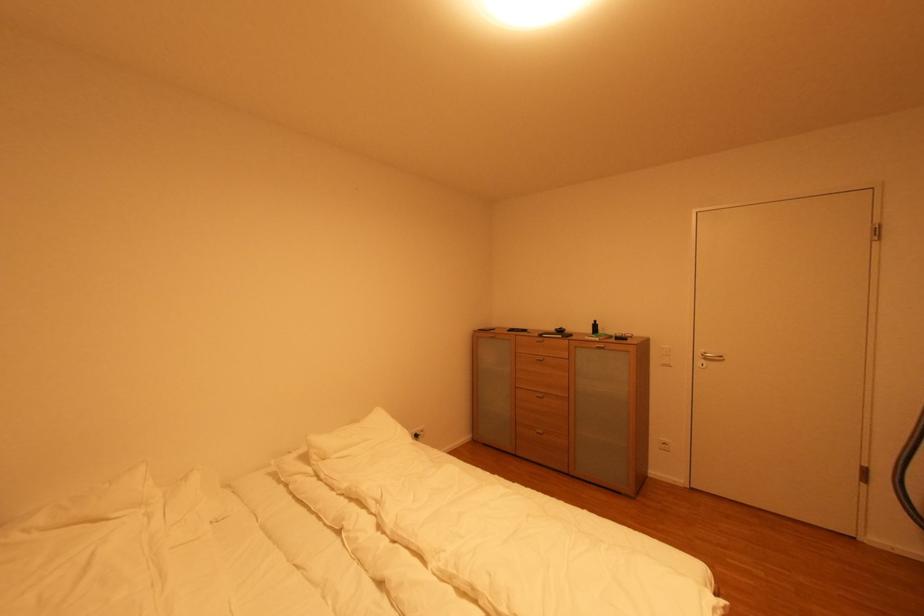
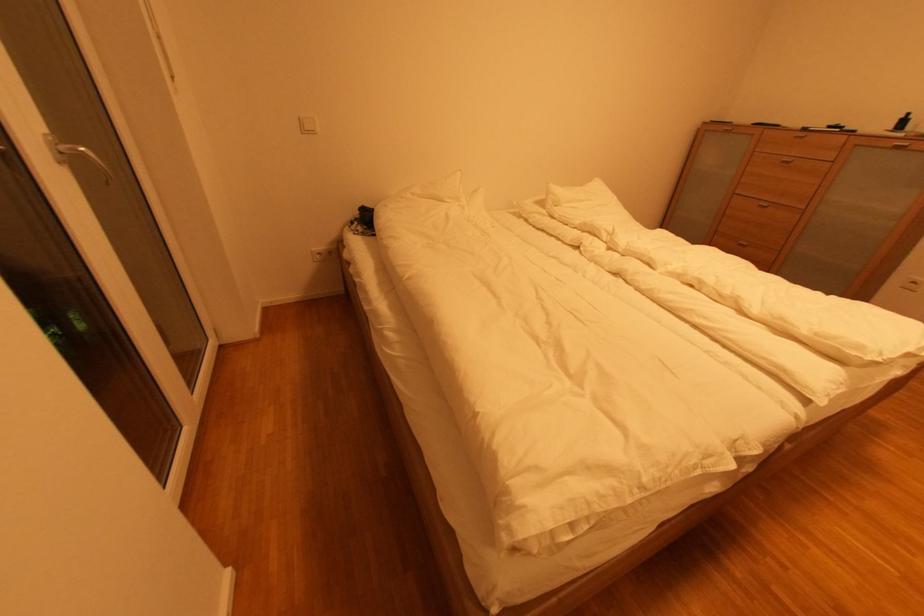
Locate, in the second image, the point that corresponds to [546,436] in the first image.

(749, 246)